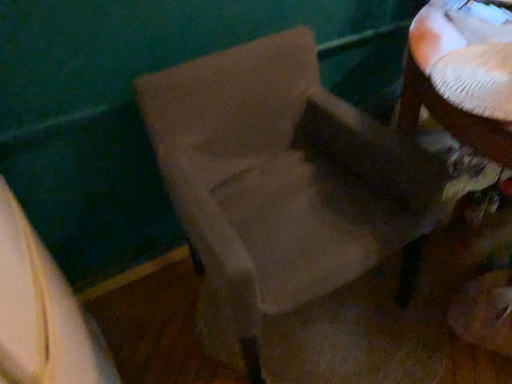
Question: From the image's perspective, would you say white fabric at lower left is positioned over white textured table at upper right?

Choices:
 (A) yes
 (B) no

Answer: (B)

Question: Is white fabric at lower left taller than white textured table at upper right?

Choices:
 (A) yes
 (B) no

Answer: (A)

Question: From a real-world perspective, is white fabric at lower left positioned over white textured table at upper right based on gravity?

Choices:
 (A) no
 (B) yes

Answer: (A)

Question: Is the position of white fabric at lower left more distant than that of white textured table at upper right?

Choices:
 (A) yes
 (B) no

Answer: (B)

Question: Considering the relative sizes of white fabric at lower left and white textured table at upper right in the image provided, is white fabric at lower left shorter than white textured table at upper right?

Choices:
 (A) yes
 (B) no

Answer: (B)

Question: Is white textured table at upper right taller or shorter than white fabric at lower left?

Choices:
 (A) tall
 (B) short

Answer: (B)

Question: Considering their positions, is white textured table at upper right located in front of or behind white fabric at lower left?

Choices:
 (A) behind
 (B) front

Answer: (A)

Question: Considering the positions of white textured table at upper right and white fabric at lower left in the image, is white textured table at upper right bigger or smaller than white fabric at lower left?

Choices:
 (A) big
 (B) small

Answer: (B)

Question: In terms of width, does white textured table at upper right look wider or thinner when compared to white fabric at lower left?

Choices:
 (A) wide
 (B) thin

Answer: (A)

Question: Considering the positions of white textured table at upper right and suede-like beige chair at center in the image, is white textured table at upper right bigger or smaller than suede-like beige chair at center?

Choices:
 (A) small
 (B) big

Answer: (A)

Question: Is white textured table at upper right in front of or behind suede-like beige chair at center in the image?

Choices:
 (A) behind
 (B) front

Answer: (A)

Question: From their relative heights in the image, would you say white textured table at upper right is taller or shorter than suede-like beige chair at center?

Choices:
 (A) short
 (B) tall

Answer: (A)

Question: From the image's perspective, is white textured table at upper right above or below suede-like beige chair at center?

Choices:
 (A) below
 (B) above

Answer: (B)

Question: Is point (288, 365) closer or farther from the camera than point (503, 150)?

Choices:
 (A) closer
 (B) farther

Answer: (B)

Question: Considering the positions of suede-like beige chair at center and white textured table at upper right in the image, is suede-like beige chair at center taller or shorter than white textured table at upper right?

Choices:
 (A) short
 (B) tall

Answer: (B)